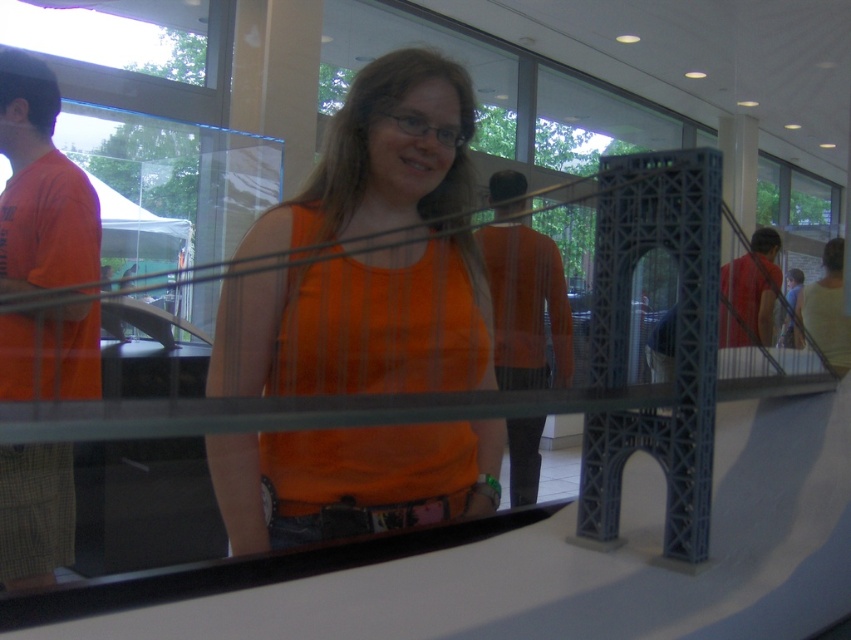
Question: Is orange matte tank top at center behind orange fabric shirt at center?

Choices:
 (A) yes
 (B) no

Answer: (B)

Question: Which object is positioned closest to the metallic blue eiffel tower at center?

Choices:
 (A) orange fabric shirt at center
 (B) matte red shirt at center

Answer: (A)

Question: Which is nearer to the orange fabric shirt at center?

Choices:
 (A) metallic blue eiffel tower at center
 (B) orange t-shirt at left

Answer: (B)

Question: Observing the image, what is the correct spatial positioning of orange matte tank top at center in reference to orange fabric shirt at center?

Choices:
 (A) below
 (B) above

Answer: (A)

Question: Which point is closer to the camera taking this photo?

Choices:
 (A) (523, 454)
 (B) (766, 268)

Answer: (A)

Question: Does orange matte tank top at center lie behind matte red shirt at center?

Choices:
 (A) no
 (B) yes

Answer: (A)